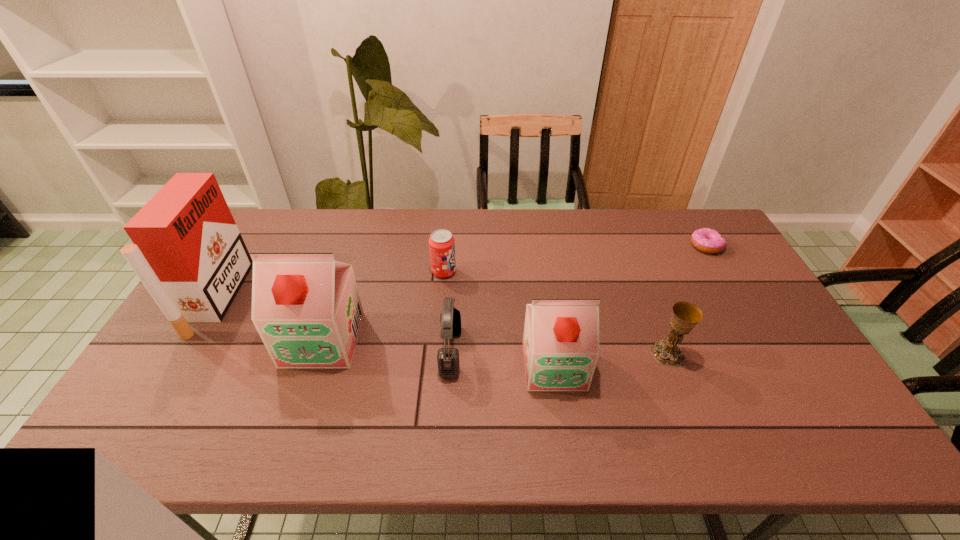
Where is `the taller soya milk`? Image resolution: width=960 pixels, height=540 pixels. the taller soya milk is located at coordinates (306, 307).

This screenshot has height=540, width=960. In order to click on the second object from left to right in this screenshot , I will do `click(306, 307)`.

Where is `the shorter soya milk`? Image resolution: width=960 pixels, height=540 pixels. the shorter soya milk is located at coordinates (561, 346).

Image resolution: width=960 pixels, height=540 pixels. In order to click on the third tallest object in this screenshot , I will do `click(561, 346)`.

You are a GUI agent. You are given a task and a screenshot of the screen. Output one action in this format:
    pyautogui.click(x=<x>, y=<y>)
    Task: Click on the soda can
    Image resolution: width=960 pixels, height=540 pixels.
    Given the screenshot: What is the action you would take?
    pyautogui.click(x=441, y=242)

Locate an element on the screen. the farthest object is located at coordinates pyautogui.click(x=706, y=240).

Where is `the shortest object`? Image resolution: width=960 pixels, height=540 pixels. the shortest object is located at coordinates [706, 240].

This screenshot has width=960, height=540. What are the coordinates of `cigarette case` in the screenshot? It's located at (188, 252).

You are a GUI agent. You are given a task and a screenshot of the screen. Output one action in this format:
    pyautogui.click(x=<x>, y=<y>)
    Task: Click on the second object from right to left
    
    Given the screenshot: What is the action you would take?
    pyautogui.click(x=685, y=315)

The height and width of the screenshot is (540, 960). Find the location of `headset`. headset is located at coordinates (447, 358).